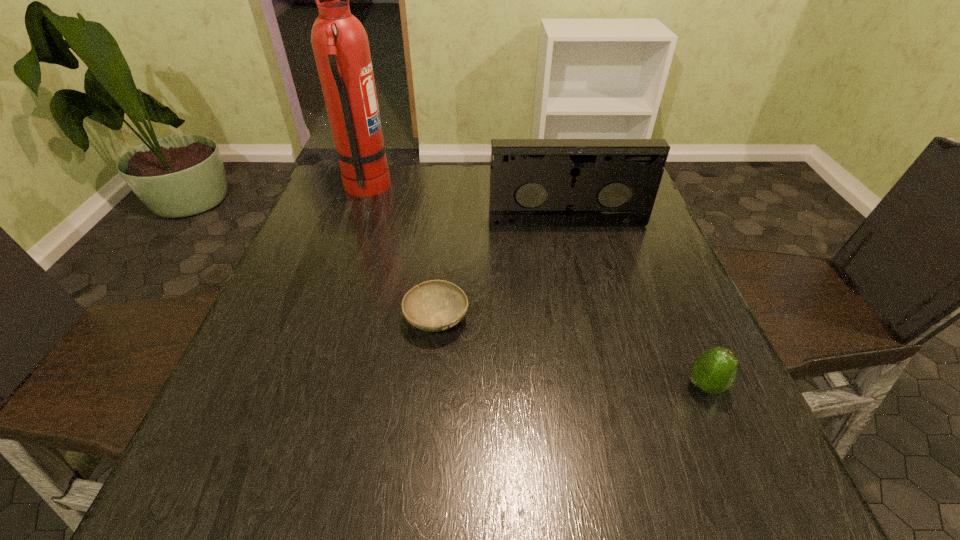
Where is `vacant area between the nearest object and the second farthest object`? The image size is (960, 540). vacant area between the nearest object and the second farthest object is located at coordinates (636, 304).

Locate which object is the second closest to the shortest object. Please provide its 2D coordinates. Your answer should be formatted as a tuple, i.e. [(x, y)], where the tuple contains the x and y coordinates of a point satisfying the conditions above.

[(340, 44)]

Select which object is the closest to the videotape. Please provide its 2D coordinates. Your answer should be formatted as a tuple, i.e. [(x, y)], where the tuple contains the x and y coordinates of a point satisfying the conditions above.

[(436, 305)]

What are the coordinates of `vacant space that satisfies the following two spatial constraints: 1. on the label side of the fire extinguisher; 2. on the right side of the second shortest object` in the screenshot? It's located at (297, 386).

Identify the location of vacant area in the image that satisfies the following two spatial constraints: 1. on the front side of the nearest object; 2. on the left side of the third nearest object. (607, 386).

Locate an element on the screen. free spot that satisfies the following two spatial constraints: 1. on the label side of the farthest object; 2. on the back side of the nearest object is located at coordinates [297, 386].

Identify the location of vacant region that satisfies the following two spatial constraints: 1. on the label side of the tallest object; 2. on the back side of the second object from left to right. pos(321,319).

Identify the location of vacant area in the image that satisfies the following two spatial constraints: 1. on the label side of the tallest object; 2. on the left side of the second object from left to right. (321, 319).

What are the coordinates of `vacant area in the image that satisfies the following two spatial constraints: 1. on the label side of the nearest object; 2. on the right side of the farthest object` in the screenshot? It's located at (297, 386).